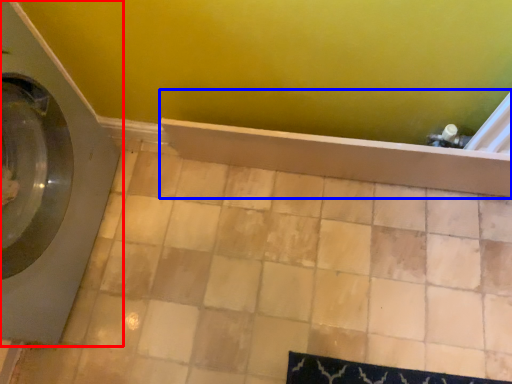
Question: Which of the following is the closest to the observer, washing machine (highlighted by a red box) or bath (highlighted by a blue box)?

Choices:
 (A) washing machine
 (B) bath

Answer: (A)